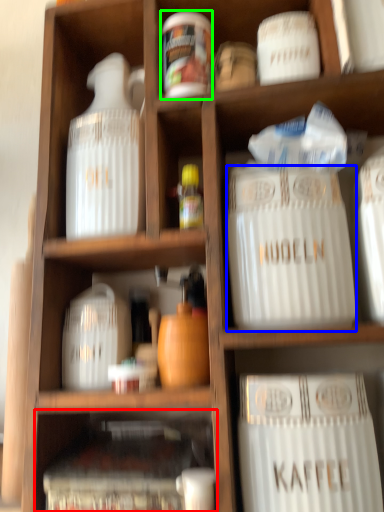
Question: Which object is the closest to the cabinet (highlighted by a red box)? Choose among these: type (highlighted by a blue box) or pottery (highlighted by a green box).

Choices:
 (A) type
 (B) pottery

Answer: (A)